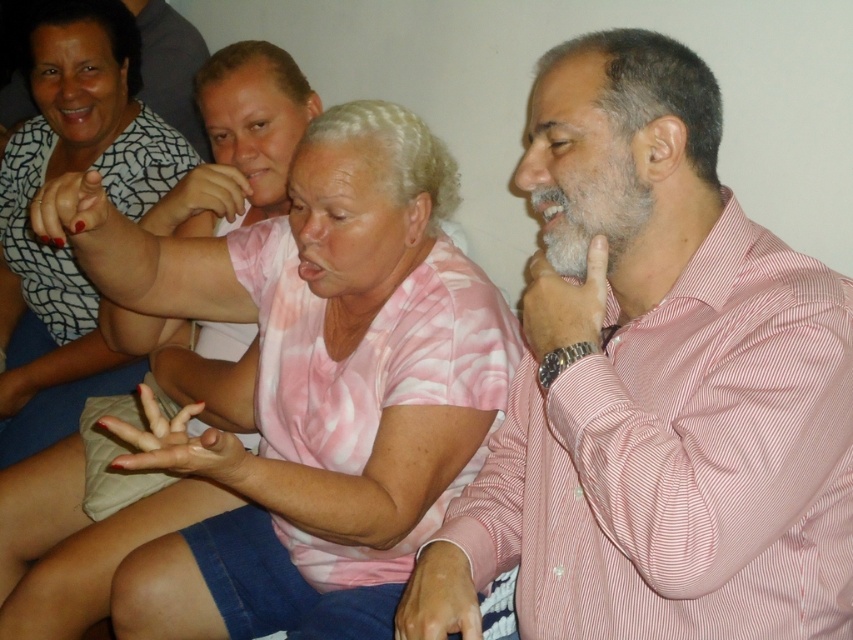
Question: Which object appears closest to the camera in this image?

Choices:
 (A) pink striped shirt at right
 (B) matte black shirt at upper left
 (C) pink tie-dye shirt at center

Answer: (A)

Question: Is pink tie-dye shirt at center above matte black shirt at upper left?

Choices:
 (A) yes
 (B) no

Answer: (B)

Question: Is pink striped shirt at right bigger than matte black shirt at upper left?

Choices:
 (A) yes
 (B) no

Answer: (B)

Question: Which of the following is the farthest from the observer?

Choices:
 (A) matte black shirt at upper left
 (B) pink tie-dye shirt at center
 (C) pink striped shirt at right

Answer: (A)

Question: Is pink striped shirt at right smaller than pink tie-dye shirt at center?

Choices:
 (A) yes
 (B) no

Answer: (A)

Question: Which point is farther to the camera?

Choices:
 (A) (804, 422)
 (B) (47, 86)
 (C) (144, 429)

Answer: (B)